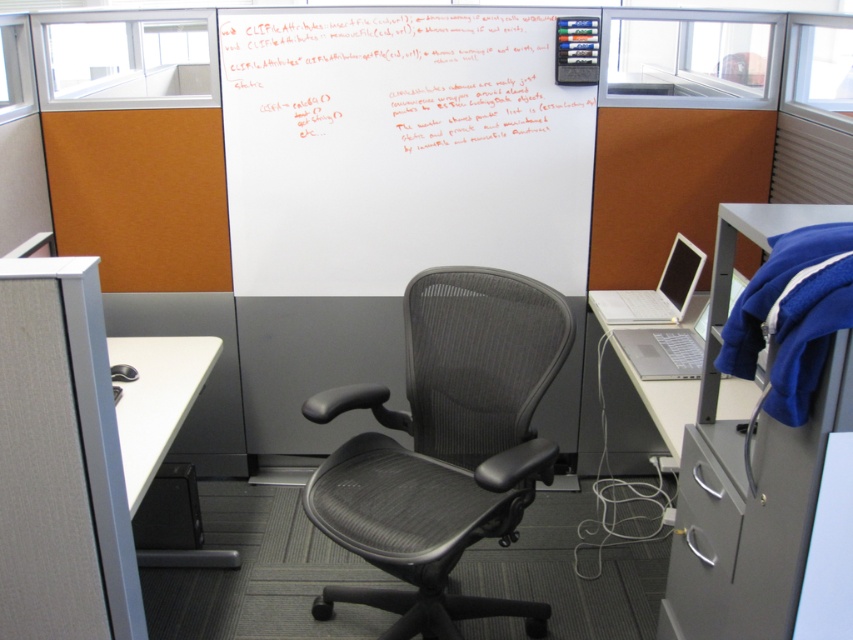
Can you confirm if silver metallic laptop at right is bigger than white matte table at lower left?

Yes.

Is silver metallic laptop at right smaller than white matte table at lower left?

Incorrect, silver metallic laptop at right is not smaller in size than white matte table at lower left.

Is point (601, 330) in front of point (119, 342)?

No, (601, 330) is behind (119, 342).

Where is `silver metallic laptop at right`? The height and width of the screenshot is (640, 853). silver metallic laptop at right is located at coordinates (642, 412).

Which is more to the right, gray metallic file cabinet at right or silver metallic laptop at right?

Positioned to the right is silver metallic laptop at right.

Between gray metallic file cabinet at right and silver metallic laptop at right, which one appears on the left side from the viewer's perspective?

Positioned to the left is gray metallic file cabinet at right.

Where is `gray metallic file cabinet at right`? The width and height of the screenshot is (853, 640). gray metallic file cabinet at right is located at coordinates (749, 472).

Can you confirm if gray metallic file cabinet at right is smaller than white matte table at lower left?

Actually, gray metallic file cabinet at right might be larger than white matte table at lower left.

Does gray metallic file cabinet at right appear on the left side of white matte table at lower left?

In fact, gray metallic file cabinet at right is to the right of white matte table at lower left.

Does point (672, 560) come in front of point (165, 369)?

Yes, it is in front of point (165, 369).

Image resolution: width=853 pixels, height=640 pixels. In order to click on gray metallic file cabinet at right in this screenshot , I will do `click(749, 472)`.